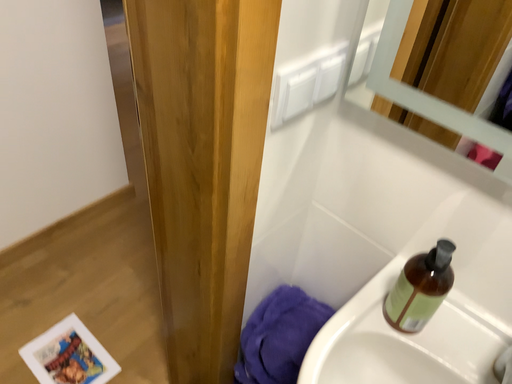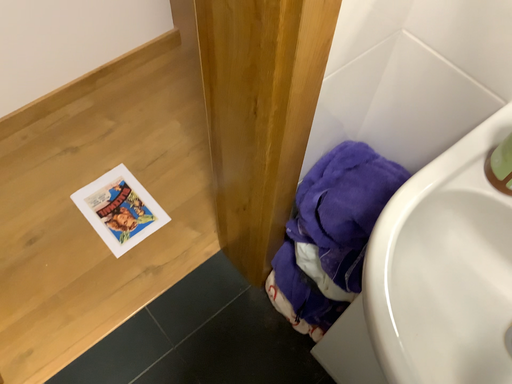
Question: How did the camera likely rotate when shooting the video?

Choices:
 (A) rotated upward
 (B) rotated downward

Answer: (B)